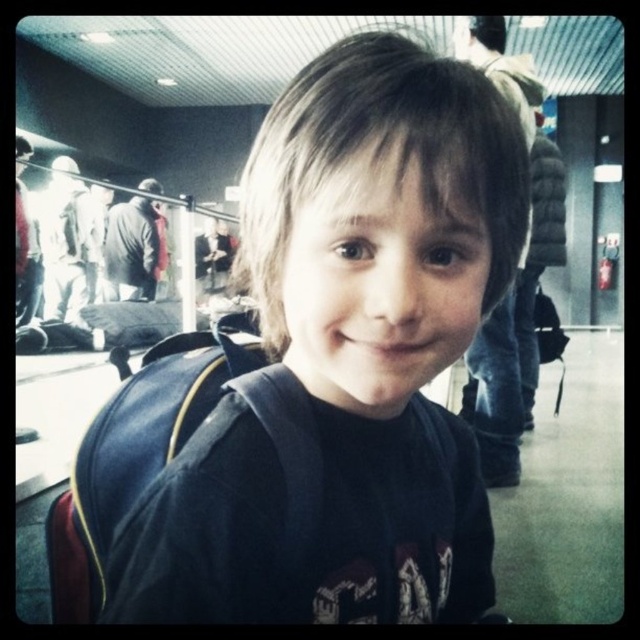
Question: Is dark blue backpack at center below matte black backpack at center?

Choices:
 (A) yes
 (B) no

Answer: (B)

Question: Can you confirm if dark blue backpack at center is smaller than matte black backpack at center?

Choices:
 (A) no
 (B) yes

Answer: (B)

Question: Is dark blue backpack at center bigger than matte black backpack at center?

Choices:
 (A) no
 (B) yes

Answer: (A)

Question: Among these points, which one is nearest to the camera?

Choices:
 (A) [x=422, y=214]
 (B) [x=499, y=465]

Answer: (A)

Question: Which of the following is the farthest from the observer?

Choices:
 (A) (454, 564)
 (B) (500, 29)

Answer: (B)